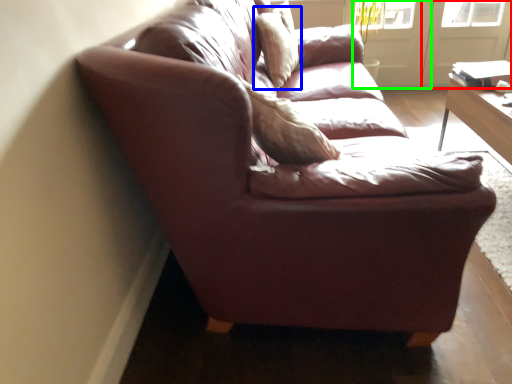
Question: Which object is the closest to the screen door (highlighted by a red box)? Choose among these: pillow (highlighted by a blue box) or screen door (highlighted by a green box).

Choices:
 (A) pillow
 (B) screen door

Answer: (B)